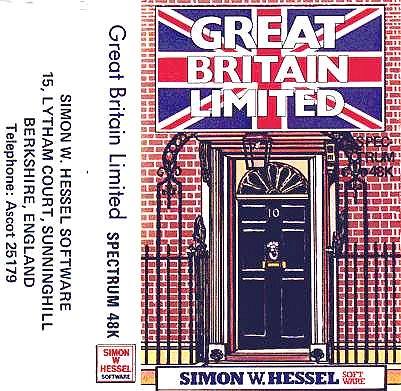
You are a GUI agent. You are given a task and a screenshot of the screen. Output one action in this format:
    pyautogui.click(x=<x>, y=<y>)
    Task: Click on the door
    Image resolution: width=401 pixels, height=391 pixels.
    Given the screenshot: What is the action you would take?
    pyautogui.click(x=285, y=292)